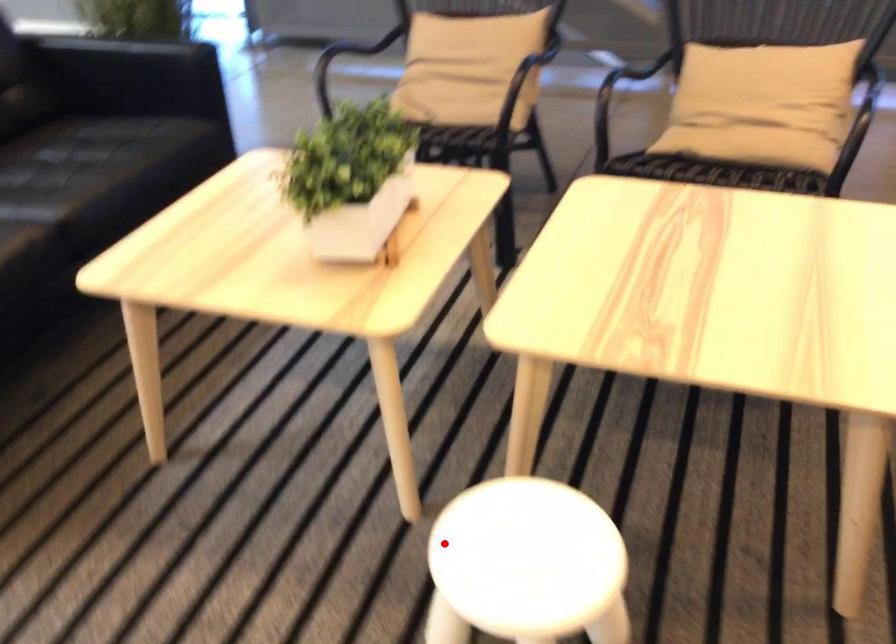
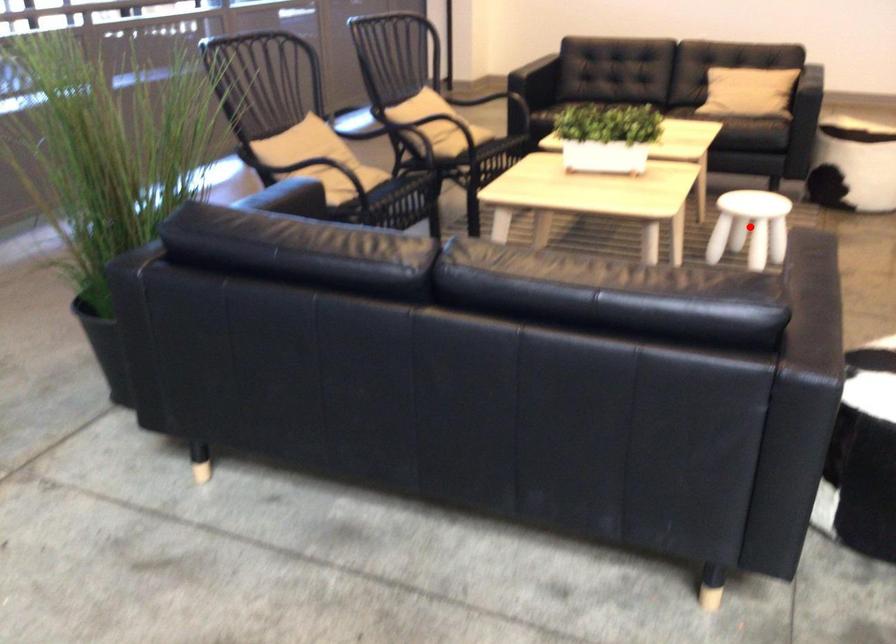
I am providing you with two images of the same scene from different viewpoints. A red point is marked on the first image and another point is marked on the second image. Is the marked point in image1 the same physical position as the marked point in image2?

Yes